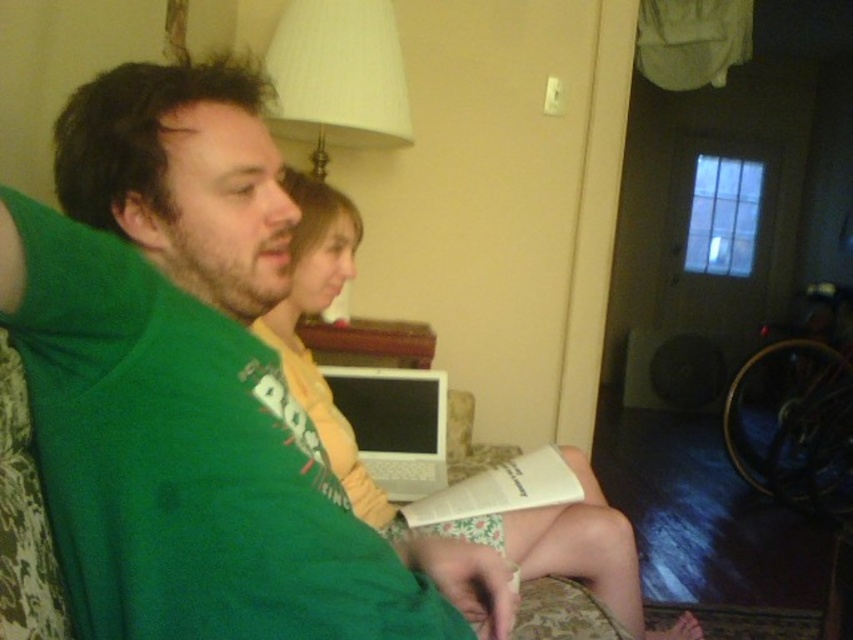
Question: Observing the image, what is the correct spatial positioning of yellow knit sweater at center in reference to white paper book at center?

Choices:
 (A) below
 (B) above

Answer: (B)

Question: Is yellow knit sweater at center smaller than white plastic laptop at center?

Choices:
 (A) yes
 (B) no

Answer: (B)

Question: Which point is closer to the camera taking this photo?

Choices:
 (A) (553, 481)
 (B) (636, 637)

Answer: (B)

Question: Which object appears closest to the camera in this image?

Choices:
 (A) white fabric lampshade at upper center
 (B) white paper book at center

Answer: (B)

Question: Is white fabric lampshade at upper center in front of white plastic laptop at center?

Choices:
 (A) yes
 (B) no

Answer: (B)

Question: Which of the following is the farthest from the observer?

Choices:
 (A) (460, 493)
 (B) (376, 438)

Answer: (B)